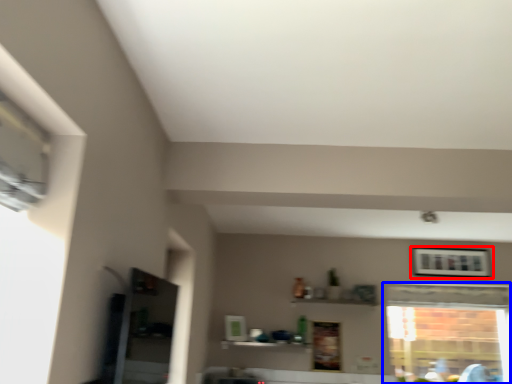
Question: Among these objects, which one is nearest to the camera, picture frame (highlighted by a red box) or window (highlighted by a blue box)?

Choices:
 (A) picture frame
 (B) window

Answer: (B)